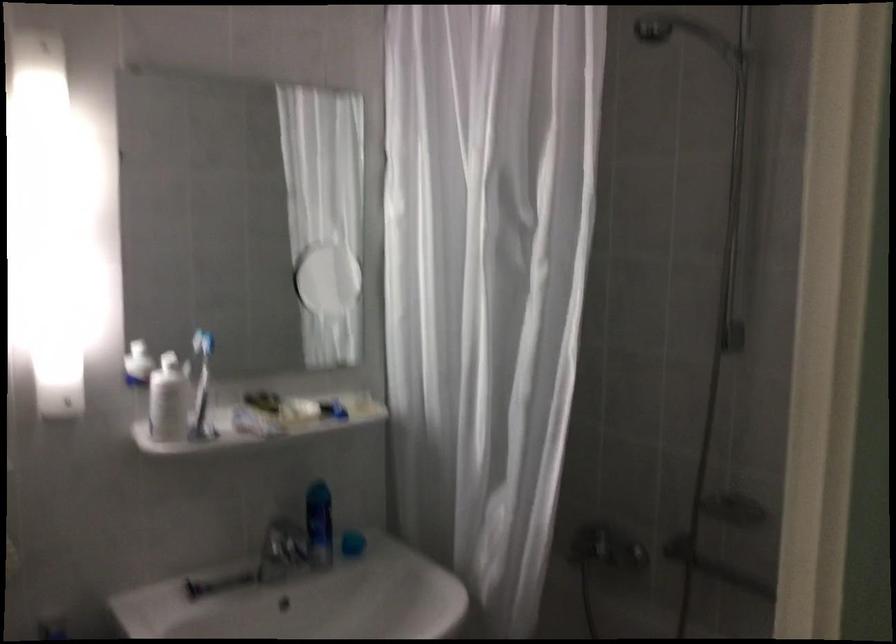
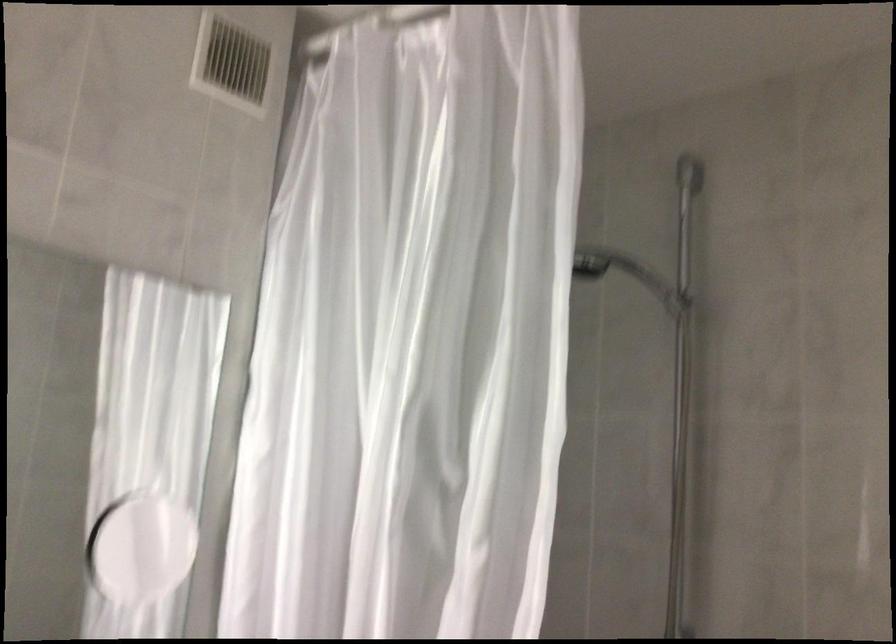
Question: The images are taken continuously from a first-person perspective. In which direction are you moving?

Choices:
 (A) Left
 (B) Right
 (C) Forward
 (D) Backward

Answer: (C)